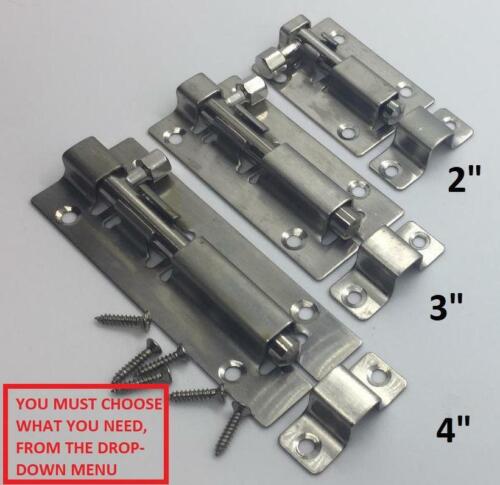
At what (x,y) coordinates should I click in order to perform the action: click on lock bolt. Please return your answer as a coordinate pair (x, y). The image size is (500, 485). Looking at the image, I should click on (166, 235), (243, 130), (330, 55).